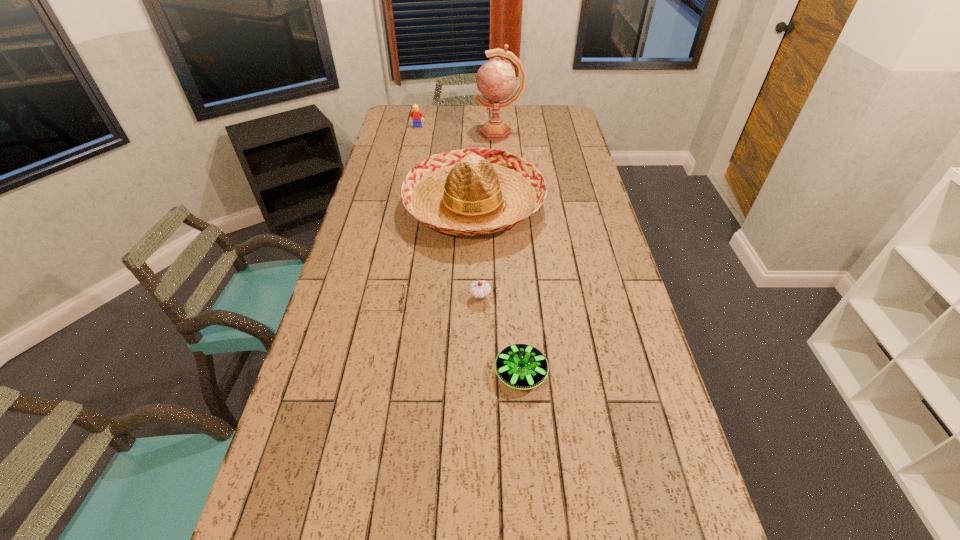
Locate an element on the screen. Image resolution: width=960 pixels, height=540 pixels. object at the far left corner is located at coordinates (416, 115).

This screenshot has height=540, width=960. I want to click on vacant space at the far edge of the desktop, so click(434, 112).

This screenshot has width=960, height=540. In the image, there is a desktop. Identify the location of free space at the left edge. (380, 170).

The height and width of the screenshot is (540, 960). In the image, there is a desktop. Identify the location of vacant space at the right edge. (583, 188).

Locate an element on the screen. This screenshot has height=540, width=960. free point at the far left corner is located at coordinates (397, 115).

I want to click on vacant area between the shortest object and the cupcake, so click(x=432, y=300).

I want to click on vacant space in between the shortest object and the Lego, so click(x=400, y=215).

Where is `vacant space in between the second shortest object and the sunglasses`? vacant space in between the second shortest object and the sunglasses is located at coordinates (452, 338).

Find the location of a particular element. This screenshot has height=540, width=960. vacant area that lies between the tallest object and the Lego is located at coordinates point(458,130).

This screenshot has height=540, width=960. I want to click on empty location between the cupcake and the shortest object, so click(x=432, y=300).